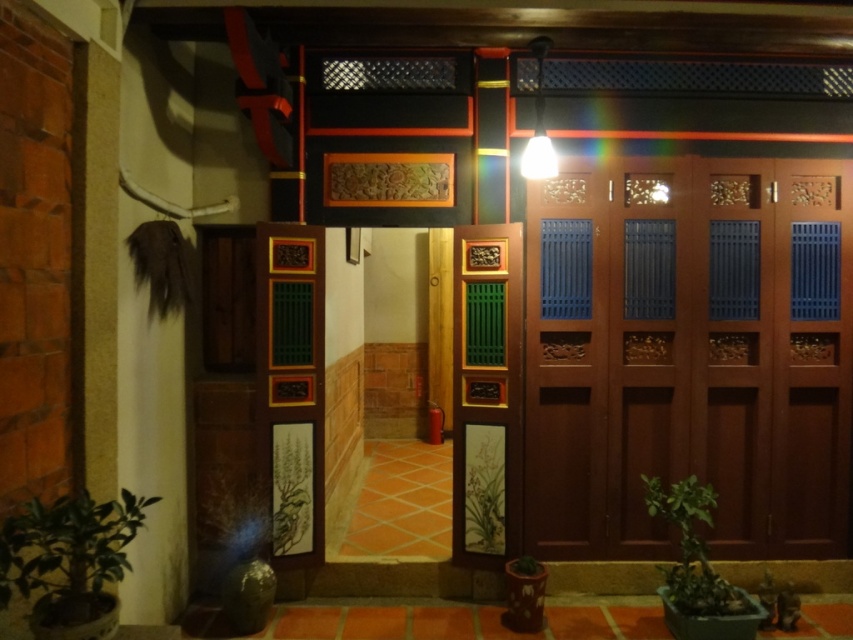
You are standing at the entrance of a traditional house and want to know the distance to a specific point marked as point (x=508, y=488). Can you estimate how far it is from your current position?

The point (x=508, y=488) is 4.05 meters away from the camera, so the distance from your current position to that point is approximately 4.05 meters.

You are a delivery person trying to place a package on the ground near the entrance. The package must be placed where it won not block the mahogany wood door at right or the green leafy plant at lower right. Based on their sizes, where should you place the package?

The mahogany wood door at right is larger than the green leafy plant at lower right, so placing the package closer to the smaller green leafy plant at lower right would be less likely to block either object.